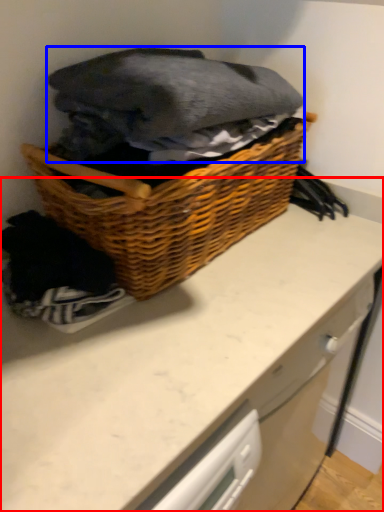
Question: Which of the following is the farthest to the observer, counter (highlighted by a red box) or clothing (highlighted by a blue box)?

Choices:
 (A) counter
 (B) clothing

Answer: (A)